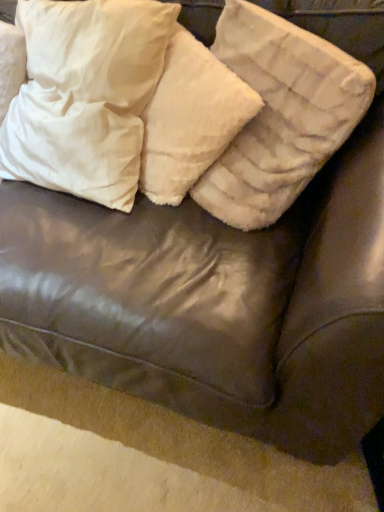
Question: Relative to white fluffy pillow at upper center, arranged as the 2th pillow when viewed from the left, is white fluffy pillow at upper center, which is counted as the 3th pillow, starting from the left, in front or behind?

Choices:
 (A) behind
 (B) front

Answer: (B)

Question: Is point (278, 192) closer or farther from the camera than point (238, 105)?

Choices:
 (A) closer
 (B) farther

Answer: (B)

Question: Which object is the closest to the white fluffy pillow at upper center, the 2th pillow positioned from the right?

Choices:
 (A) white fluffy pillow at upper center, marked as the 1th pillow in a right-to-left arrangement
 (B) white soft pillow at upper left, which is the 3th pillow in right-to-left order

Answer: (A)

Question: Which object is the closest to the white fluffy pillow at upper center, which is counted as the 3th pillow, starting from the left?

Choices:
 (A) white fluffy pillow at upper center, the 2th pillow positioned from the right
 (B) white soft pillow at upper left, which is the 3th pillow in right-to-left order

Answer: (A)